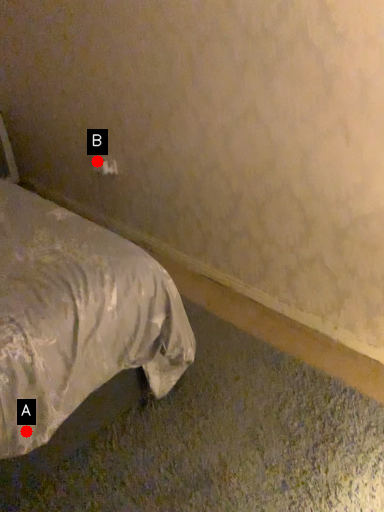
Question: Two points are circled on the image, labeled by A and B beside each circle. Which of the following is the closest to the observer?

Choices:
 (A) A is closer
 (B) B is closer

Answer: (A)